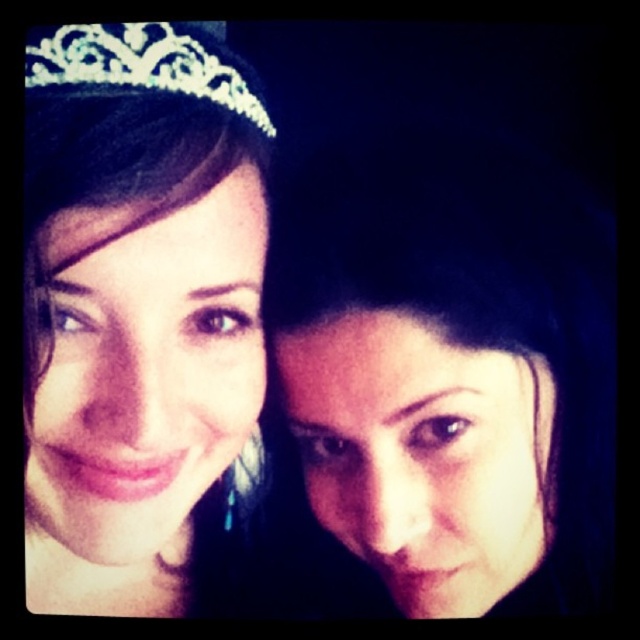
Can you confirm if smooth skin face at right is positioned above clear crystal tiara at upper left?

Incorrect, smooth skin face at right is not positioned above clear crystal tiara at upper left.

Between smooth skin face at right and clear crystal tiara at upper left, which one has less height?

clear crystal tiara at upper left

Where is `smooth skin face at right`? The width and height of the screenshot is (640, 640). smooth skin face at right is located at coordinates (449, 372).

Who is taller, matte silver tiara at upper left or clear crystal tiara at upper left?

matte silver tiara at upper left is taller.

Which is in front, point (122, 484) or point (80, 90)?

Point (80, 90) is more forward.

Locate an element on the screen. This screenshot has width=640, height=640. matte silver tiara at upper left is located at coordinates (140, 314).

Does point (445, 180) come closer to viewer compared to point (68, 168)?

No, it is not.

Image resolution: width=640 pixels, height=640 pixels. I want to click on smooth skin face at right, so click(449, 372).